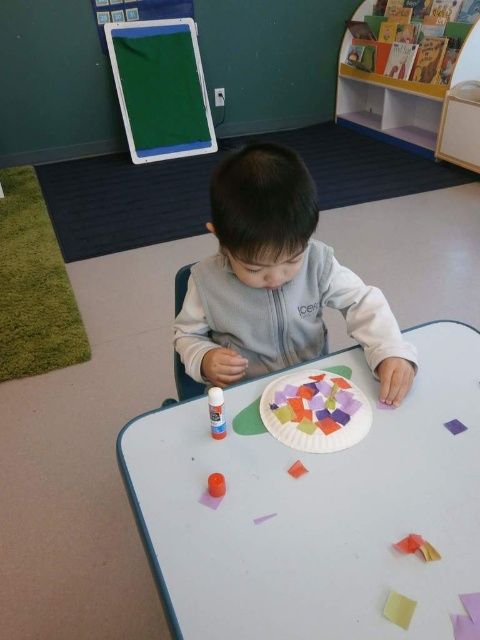
You are a teacher observing the craft activity. You need to place a ruler between the matte glue stick at center and the gold metallic toy at lower right so that it touches both items. What is the minimum length of the ruler you should choose?

The matte glue stick at center and the gold metallic toy at lower right are 12.80 inches apart. Therefore, the minimum length of the ruler needed to touch both items is 12.80 inches.

You are a teacher who wants to ensure the craft materials are within a 30 inch safety zone around the child. Is the matte glue stick at center within this zone?

The matte glue stick at center is 32.60 inches away from the camera, which is beyond the 30 inch safety zone. Therefore, it is outside the safety zone.